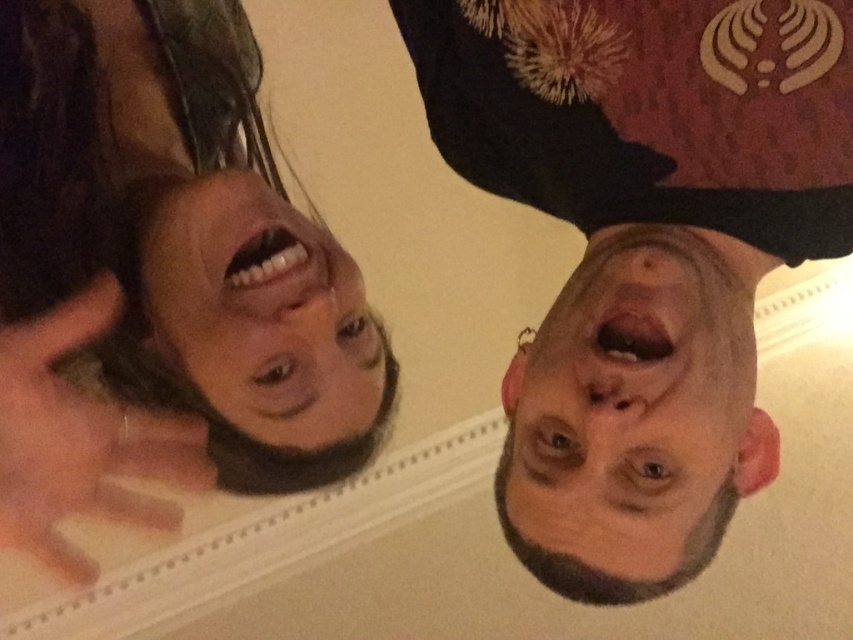
Is the position of dark brown hair at upper left less distant than that of smooth skin face at upper left?

Yes, dark brown hair at upper left is closer to the viewer.

Does dark brown hair at upper left have a greater width compared to smooth skin face at upper left?

Correct, the width of dark brown hair at upper left exceeds that of smooth skin face at upper left.

Find the location of a particular element. The height and width of the screenshot is (640, 853). dark brown hair at upper left is located at coordinates (163, 273).

Locate an element on the screen. dark brown hair at upper left is located at coordinates (163, 273).

Does bald head at lower right appear on the left side of smooth skin face at upper left?

Incorrect, bald head at lower right is not on the left side of smooth skin face at upper left.

Can you confirm if bald head at lower right is positioned to the right of smooth skin face at upper left?

Yes, bald head at lower right is to the right of smooth skin face at upper left.

Find the location of a particular element. Image resolution: width=853 pixels, height=640 pixels. bald head at lower right is located at coordinates (633, 417).

Locate an element on the screen. dark brown hair at upper left is located at coordinates (163, 273).

Between dark brown hair at upper left and bald head at lower right, which one has more height?

dark brown hair at upper left is taller.

At what (x,y) coordinates should I click in order to perform the action: click on dark brown hair at upper left. Please return your answer as a coordinate pair (x, y). The width and height of the screenshot is (853, 640). Looking at the image, I should click on (163, 273).